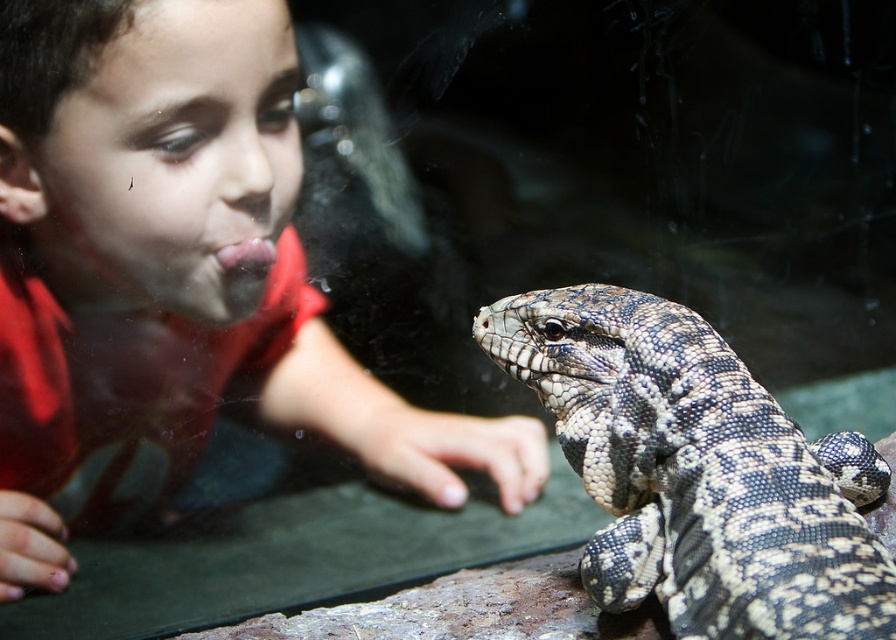
You are a zookeeper checking the enclosure. You notice the matte red shirt at upper left and the speckled scaly lizard at center. Which object is positioned higher in the image?

The matte red shirt at upper left is taller than the speckled scaly lizard at center, so the matte red shirt at upper left is positioned higher in the image.

You are a zookeeper who needs to place a feeding tray for the lizard. The tray must be positioned exactly 0.2 meters away from the matte red shirt at upper left. Where should you place the feeding tray in relation to the shirt?

The feeding tray should be placed 0.2 meters away from the matte red shirt at upper left. Since the shirt is at point (177, 275), the tray should be positioned at coordinates that are 0.2 meters away from this point, either to the left, right, above, or below, depending on the direction desired.

You are a zookeeper who needs to clean the glass enclosure where the child and the lizard are. The cleaning tool you have can reach up to 5 feet. Is the point at coordinates point (205, 116) within the reachable area of your tool?

The distance of point (205, 116) from camera is 5.76 feet, which is beyond the 5 feet reach of the cleaning tool. Therefore, the point at coordinates point (205, 116) is not within the reachable area of the tool.